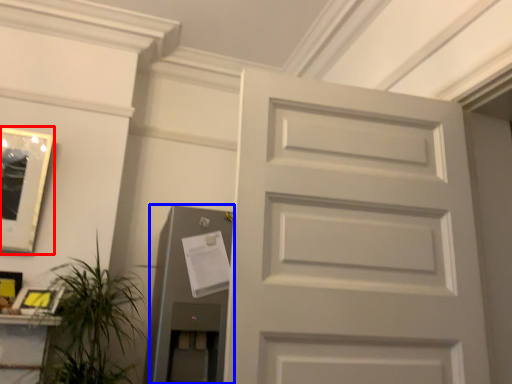
Question: Among these objects, which one is farthest to the camera, picture frame (highlighted by a red box) or elevator (highlighted by a blue box)?

Choices:
 (A) picture frame
 (B) elevator

Answer: (A)